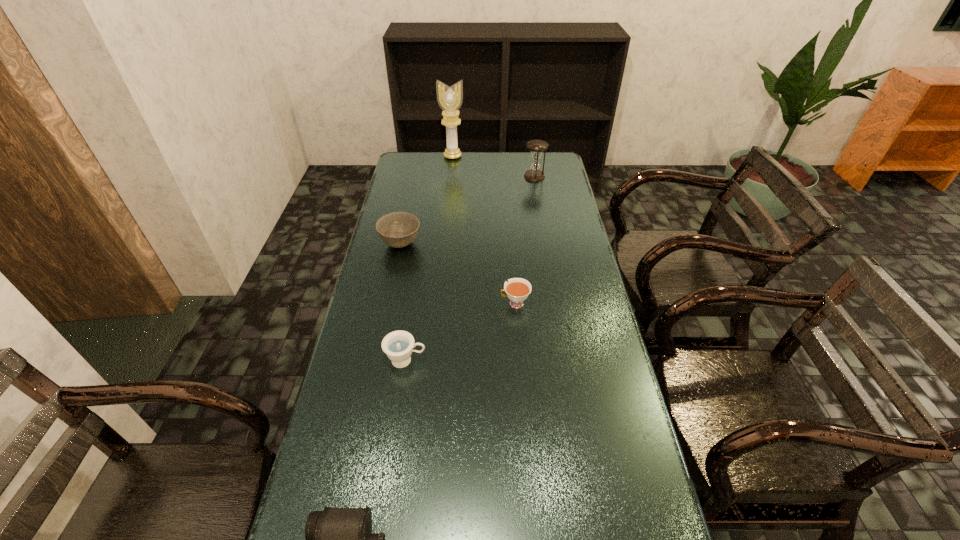
Locate an element on the screen. object at the right edge is located at coordinates (534, 174).

Where is `object present at the far right corner`? The image size is (960, 540). object present at the far right corner is located at coordinates [x=534, y=174].

The height and width of the screenshot is (540, 960). I want to click on vacant space at the far edge, so click(x=468, y=171).

Find the location of a particular element. The height and width of the screenshot is (540, 960). vacant space at the left edge of the desktop is located at coordinates (372, 315).

In the image, there is a desktop. Identify the location of vacant space at the right edge. The image size is (960, 540). (565, 241).

I want to click on empty space that is in between the award and the farther teacup, so click(484, 230).

In order to click on vacant area that lies between the bowl and the right teacup in this screenshot , I will do `click(458, 274)`.

Find the location of `free spot between the nearer teacup and the farthest object`. free spot between the nearer teacup and the farthest object is located at coordinates (429, 259).

Identify the location of vacant area that lies between the third farthest object and the left teacup. Image resolution: width=960 pixels, height=540 pixels. (403, 302).

Select which object is the fifth closest to the left teacup. Please provide its 2D coordinates. Your answer should be formatted as a tuple, i.e. [(x, y)], where the tuple contains the x and y coordinates of a point satisfying the conditions above.

[(450, 99)]